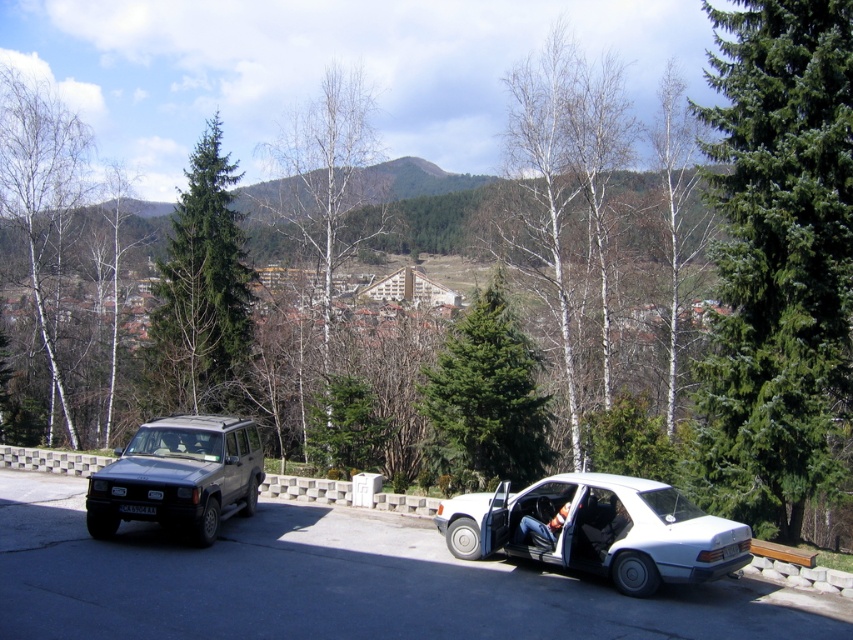
Question: Can you confirm if white matte sedan at center is thinner than metallic gray suv at left?

Choices:
 (A) no
 (B) yes

Answer: (A)

Question: Which object is closer to the camera taking this photo?

Choices:
 (A) metallic gray suv at left
 (B) white matte sedan at center

Answer: (B)

Question: Which point appears closest to the camera in this image?

Choices:
 (A) (624, 480)
 (B) (146, 470)

Answer: (A)

Question: Is white matte sedan at center above metallic gray suv at left?

Choices:
 (A) yes
 (B) no

Answer: (B)

Question: Does white matte sedan at center come in front of metallic gray suv at left?

Choices:
 (A) no
 (B) yes

Answer: (B)